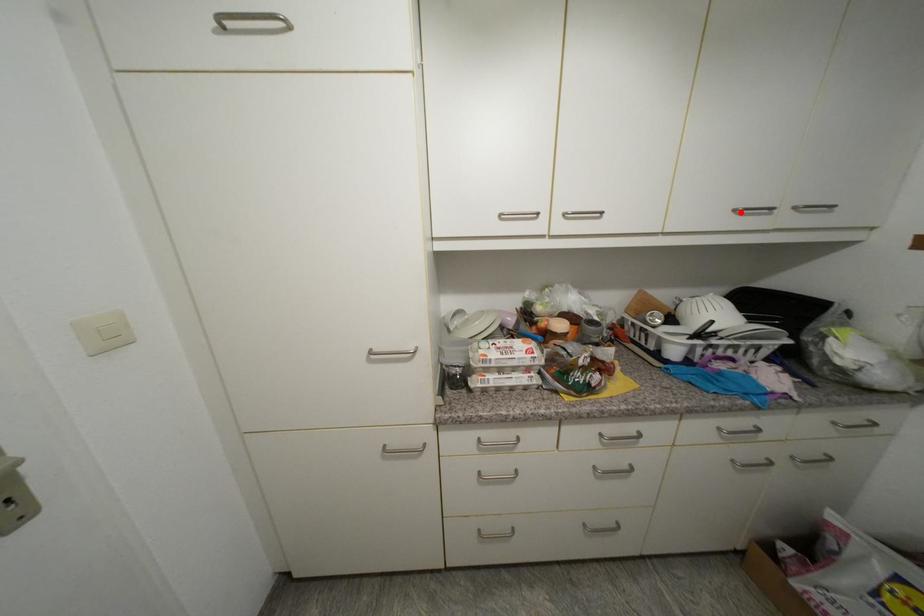
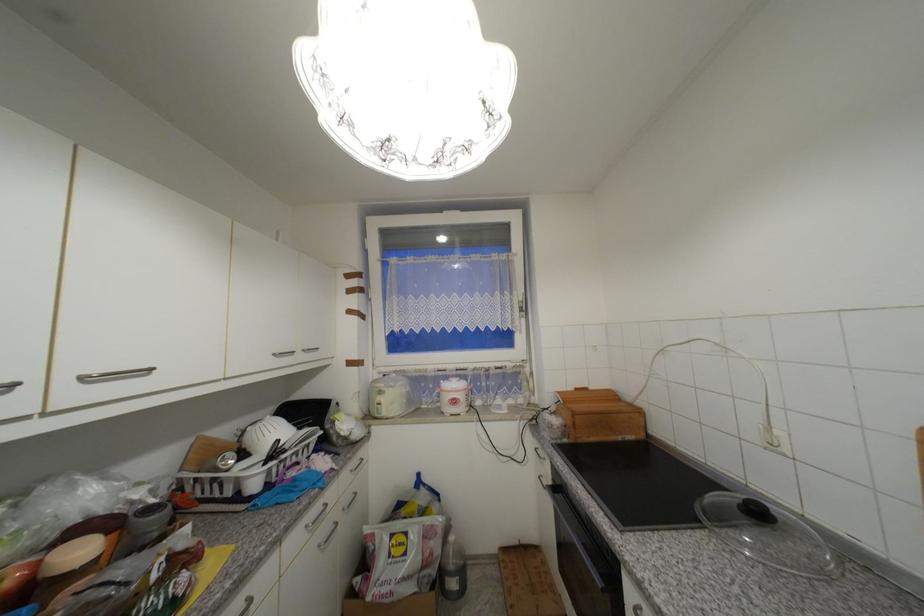
Where in the second image is the point corresponding to the highlighted location from the first image?

(281, 355)